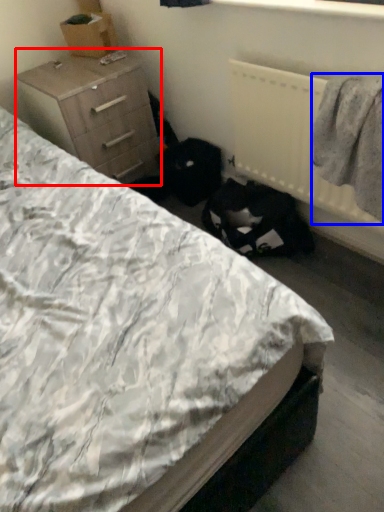
Question: Which of the following is the closest to the observer, chest of drawers (highlighted by a red box) or clothing (highlighted by a blue box)?

Choices:
 (A) chest of drawers
 (B) clothing

Answer: (B)